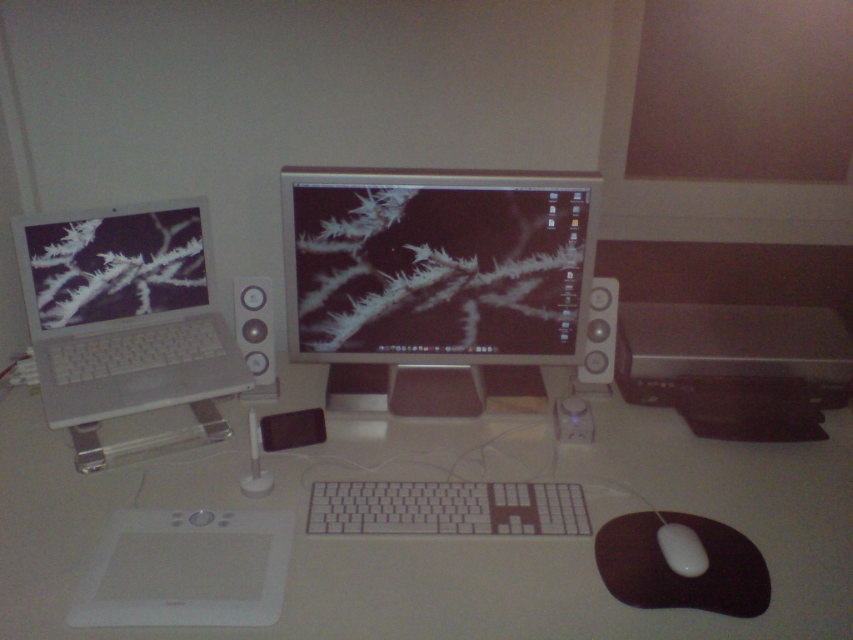
From the picture: Does matte black monitor at center have a lesser width compared to satin silver speaker at right?

No, matte black monitor at center is not thinner than satin silver speaker at right.

Between point (293, 202) and point (613, 353), which one is positioned behind?

Positioned behind is point (613, 353).

Locate an element on the screen. matte black monitor at center is located at coordinates (434, 266).

Is the position of matte black monitor at center less distant than that of silver metallic laptop at left?

→ No, it is behind silver metallic laptop at left.

Can you confirm if matte black monitor at center is wider than silver metallic laptop at left?

Correct, the width of matte black monitor at center exceeds that of silver metallic laptop at left.

Who is more distant from viewer, (474,218) or (64,252)?

The point (64,252) is more distant.

Where is `matte black monitor at center`? This screenshot has width=853, height=640. matte black monitor at center is located at coordinates (434, 266).

Can you confirm if white plastic keyboard at center is bigger than white matte mouse at lower right?

Yes.

Does white plastic keyboard at center have a smaller size compared to white matte mouse at lower right?

Actually, white plastic keyboard at center might be larger than white matte mouse at lower right.

Consider the image. Measure the distance between point (x=434, y=512) and camera.

The distance of point (x=434, y=512) from camera is 3.80 feet.

Image resolution: width=853 pixels, height=640 pixels. In order to click on white plastic keyboard at center in this screenshot , I will do `click(445, 508)`.